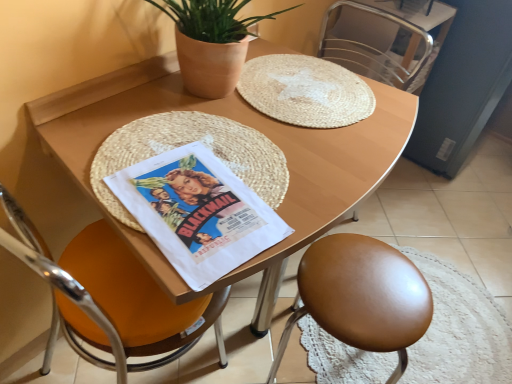
Locate an element on the screen. This screenshot has width=512, height=384. vacant space in brown leather stool at lower right, which is the 2th chair in right-to-left order (from a real-world perspective) is located at coordinates (335, 364).